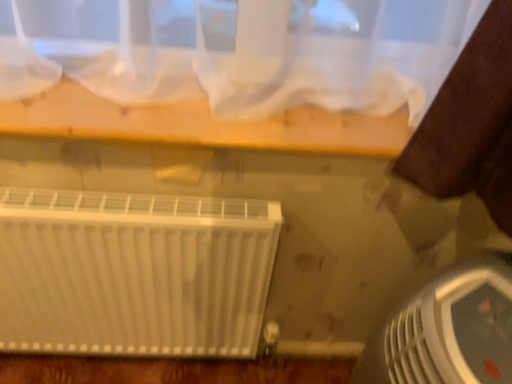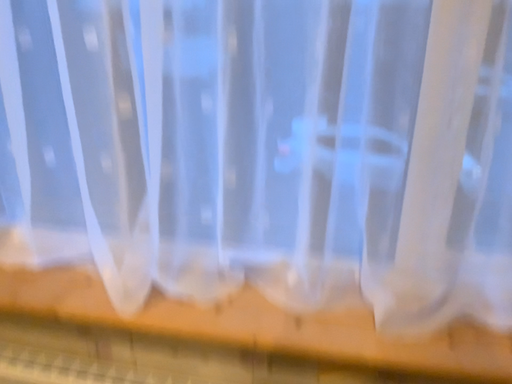
Question: How did the camera likely rotate when shooting the video?

Choices:
 (A) rotated upward
 (B) rotated downward

Answer: (A)